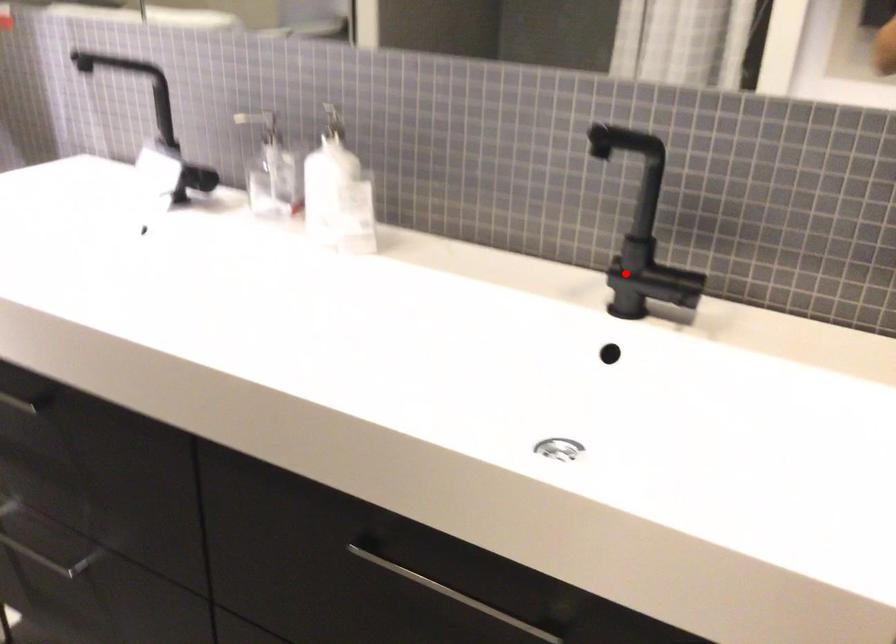
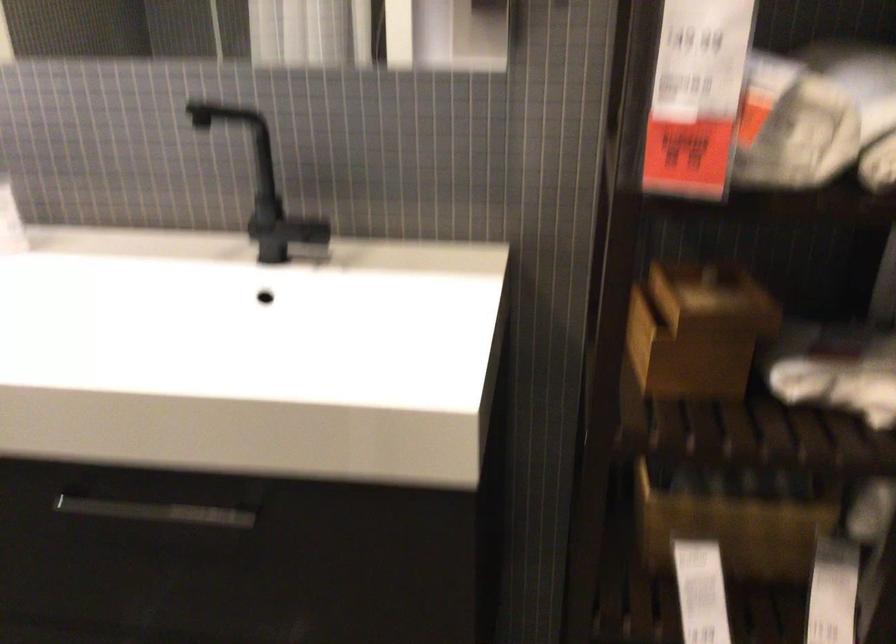
Question: A red point is marked in image1. In image2, is the corresponding 3D point closer to the camera or farther? Reply with the corresponding letter.

Choices:
 (A) The corresponding 3D point is closer.
 (B) The corresponding 3D point is farther.

Answer: (B)